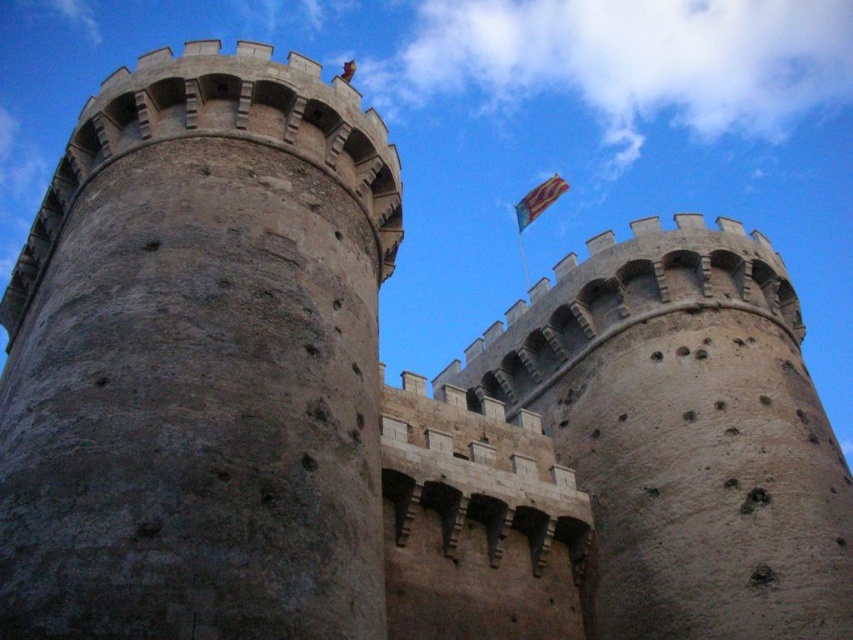
Question: Which object appears closest to the camera in this image?

Choices:
 (A) rustic stone tower at upper center
 (B) brown stone tower at left

Answer: (B)

Question: Can you confirm if brown stone tower at left is smaller than yellow-orange fabric flag at upper center?

Choices:
 (A) no
 (B) yes

Answer: (B)

Question: Estimate the real-world distances between objects in this image. Which object is closer to the brown stone tower at left?

Choices:
 (A) yellow-orange fabric flag at upper center
 (B) rustic stone tower at upper center

Answer: (B)

Question: Which object is positioned closest to the yellow-orange fabric flag at upper center?

Choices:
 (A) brown stone tower at left
 (B) rustic stone tower at upper center

Answer: (B)

Question: Is rustic stone tower at upper center to the right of yellow-orange fabric flag at upper center from the viewer's perspective?

Choices:
 (A) no
 (B) yes

Answer: (A)

Question: Does brown stone tower at left lie behind yellow-orange fabric flag at upper center?

Choices:
 (A) no
 (B) yes

Answer: (A)